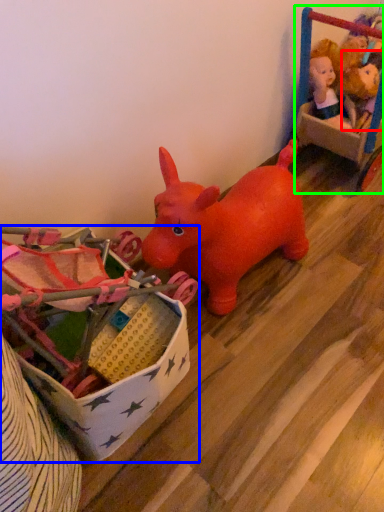
Question: Which object is the closest to the toy (highlighted by a red box)? Choose among these: toy (highlighted by a blue box) or toy (highlighted by a green box).

Choices:
 (A) toy
 (B) toy

Answer: (B)